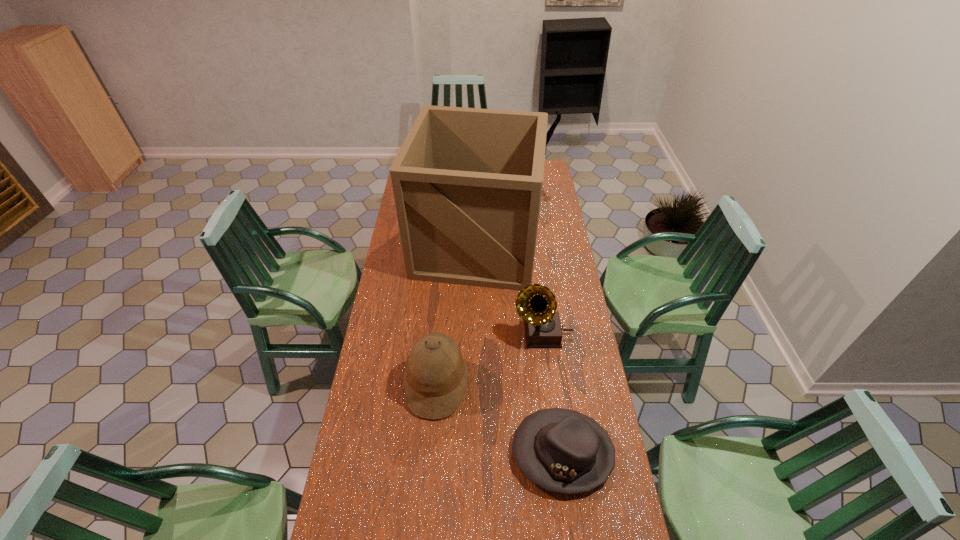
Find the location of a particular element. The image size is (960, 540). vacant area that lies between the phonograph record and the right hat is located at coordinates (552, 393).

Identify the location of free spot between the left hat and the fourth nearest object. This screenshot has width=960, height=540. (457, 314).

You are a GUI agent. You are given a task and a screenshot of the screen. Output one action in this format:
    pyautogui.click(x=<x>, y=<y>)
    Task: Click on the vacant area that lies between the third farthest object and the left hat
    
    Given the screenshot: What is the action you would take?
    pyautogui.click(x=490, y=359)

At what (x,y) coordinates should I click in order to perform the action: click on object that is the second closest one to the box. Please return your answer as a coordinate pair (x, y). The width and height of the screenshot is (960, 540). Looking at the image, I should click on (550, 132).

I want to click on object that is the third closest to the left hat, so click(467, 182).